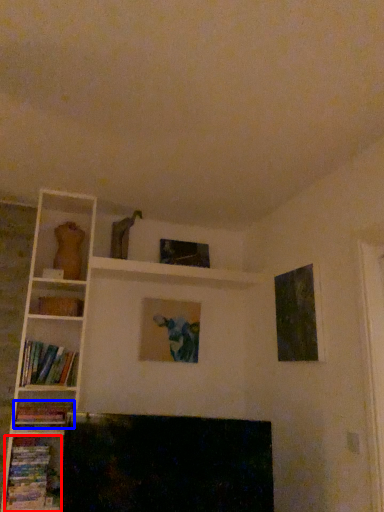
Question: Which object is further to the camera taking this photo, book (highlighted by a red box) or book (highlighted by a blue box)?

Choices:
 (A) book
 (B) book

Answer: (B)